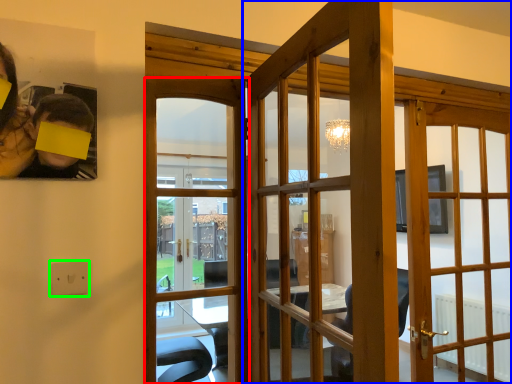
Question: Which object is positioned closest to door (highlighted by a red box)? Select from door (highlighted by a blue box) and electric outlet (highlighted by a green box).

Choices:
 (A) door
 (B) electric outlet

Answer: (A)